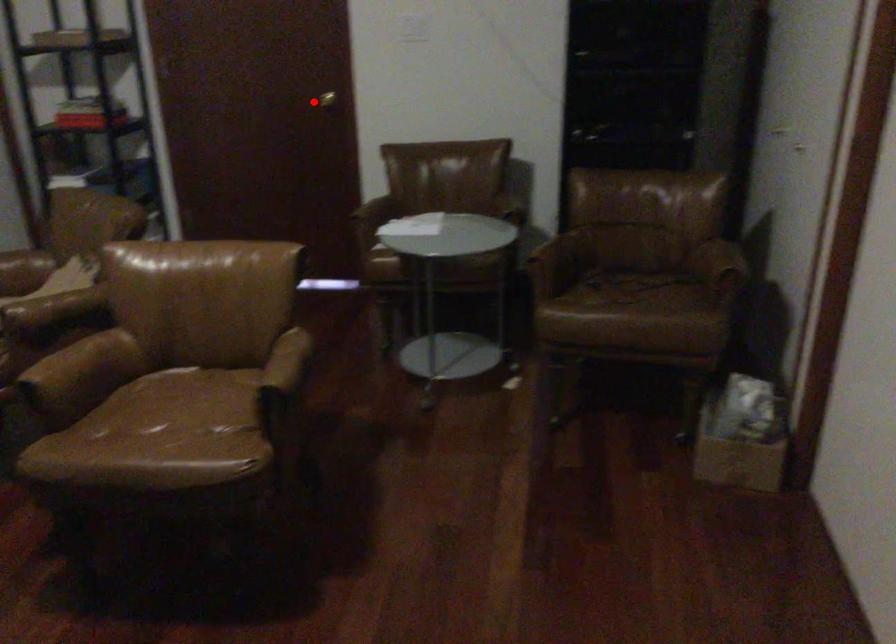
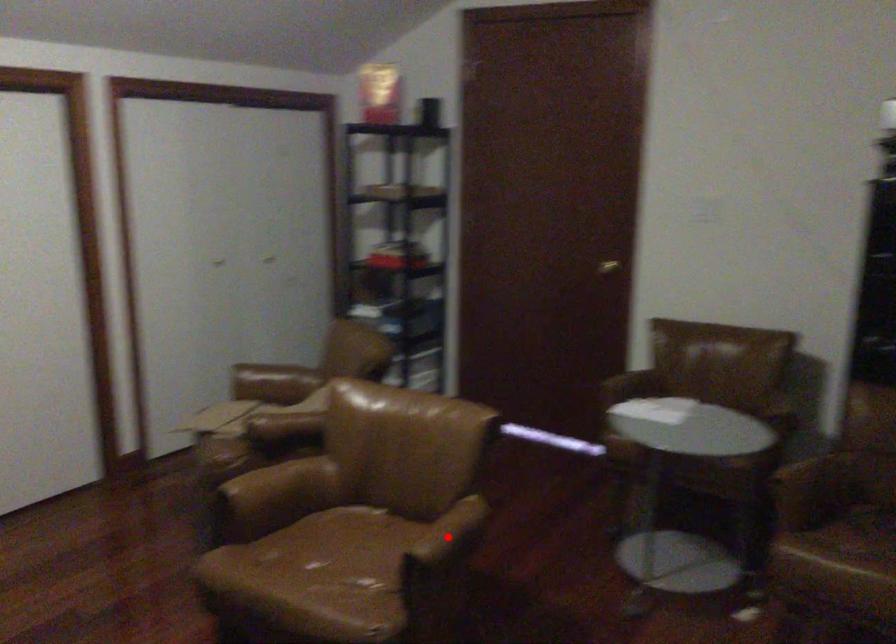
I am providing you with two images of the same scene from different viewpoints. A red point is marked on the first image and another point is marked on the second image. Does the point marked in image1 correspond to the same location as the one in image2?

No